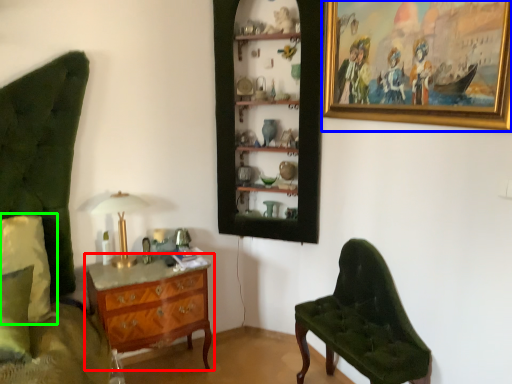
Question: Which object is positioned farthest from chest of drawers (highlighted by a red box)? Select from picture frame (highlighted by a blue box) and pillow (highlighted by a green box).

Choices:
 (A) picture frame
 (B) pillow

Answer: (A)